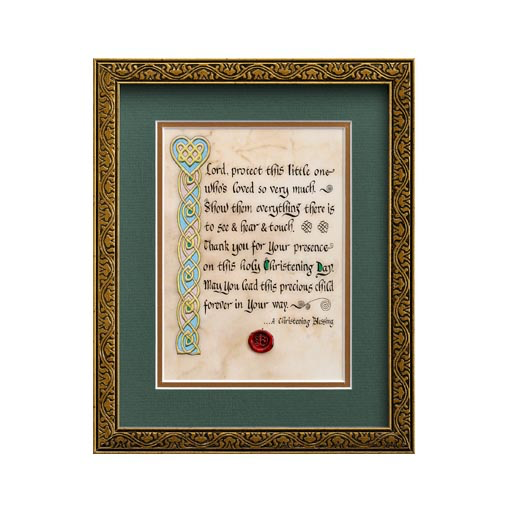
The image size is (508, 511). I want to click on gold border, so click(x=185, y=386).